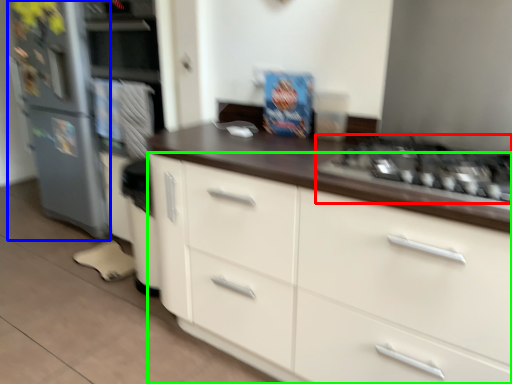
Question: Estimate the real-world distances between objects in this image. Which object is farther from gas stove (highlighted by a red box), refrigerator (highlighted by a blue box) or cabinetry (highlighted by a green box)?

Choices:
 (A) refrigerator
 (B) cabinetry

Answer: (A)